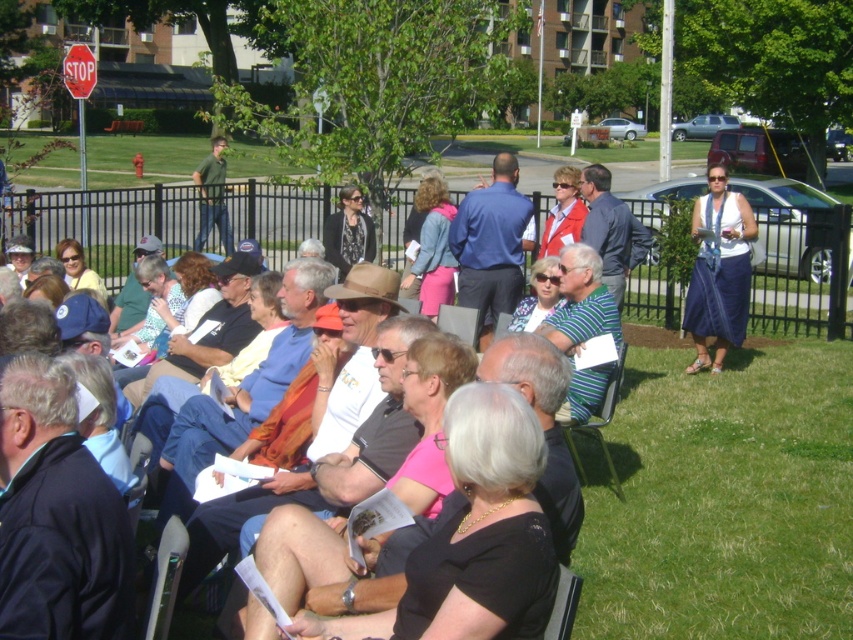
Question: Where is striped fabric chair at center located in relation to metallic red stop sign at upper left in the image?

Choices:
 (A) left
 (B) right

Answer: (B)

Question: Which of the following is the farthest from the observer?

Choices:
 (A) (218, 161)
 (B) (759, 353)

Answer: (A)

Question: Which point appears farthest from the camera in this image?

Choices:
 (A) (212, 156)
 (B) (611, 477)

Answer: (A)

Question: Where is green grass at lower right located in relation to green casual shirt at center in the image?

Choices:
 (A) left
 (B) right

Answer: (B)

Question: Which of the following is the closest to the observer?

Choices:
 (A) metallic red stop sign at upper left
 (B) striped fabric chair at center
 (C) denim skirt at right

Answer: (B)

Question: Can you confirm if green casual shirt at center is positioned to the right of metallic red stop sign at upper left?

Choices:
 (A) yes
 (B) no

Answer: (A)